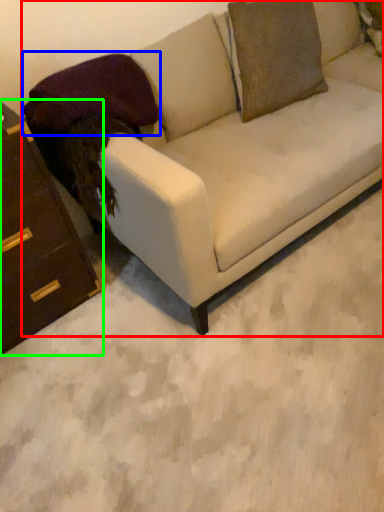
Question: Considering the real-world distances, which object is closest to studio couch (highlighted by a red box)? pillow (highlighted by a blue box) or chest of drawers (highlighted by a green box).

Choices:
 (A) pillow
 (B) chest of drawers

Answer: (A)